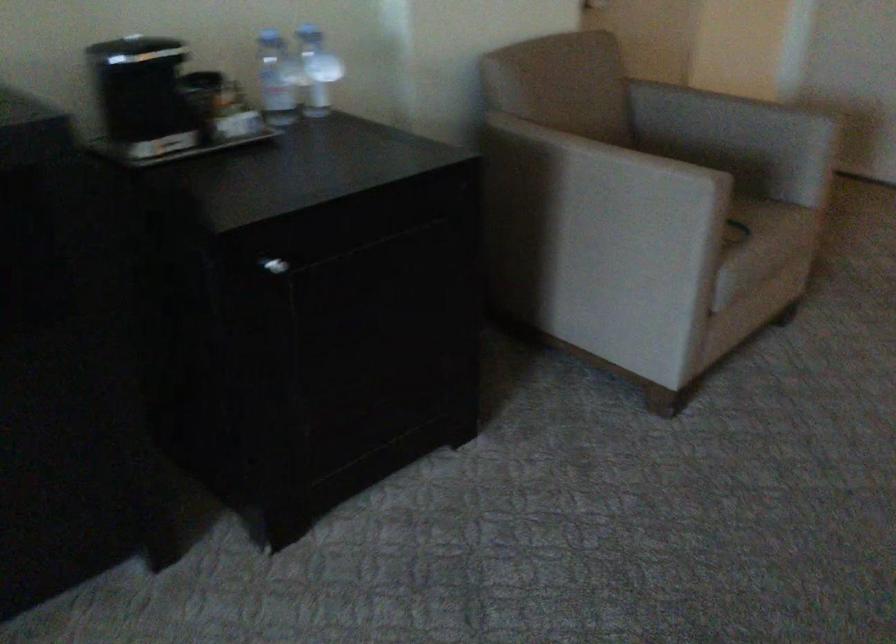
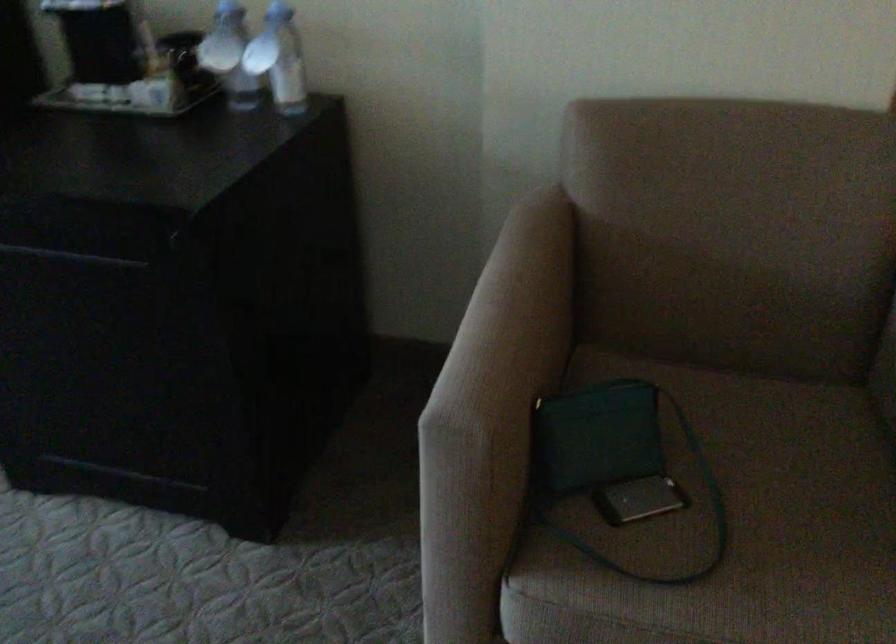
Where in the second image is the point corresponding to (x=694, y=165) from the first image?

(495, 390)